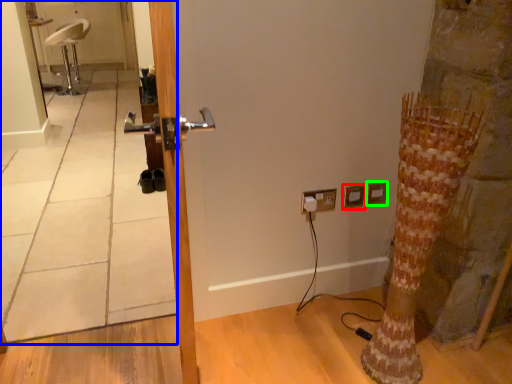
Question: Which is nearer to the electric outlet (highlighted by a red box)? mirror (highlighted by a blue box) or electric outlet (highlighted by a green box).

Choices:
 (A) mirror
 (B) electric outlet

Answer: (B)